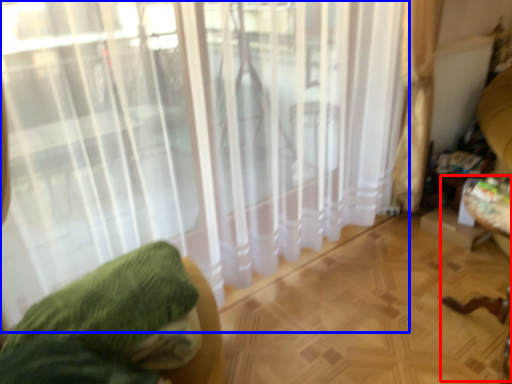
Question: Which object appears farthest to the camera in this image, swivel chair (highlighted by a red box) or curtain (highlighted by a blue box)?

Choices:
 (A) swivel chair
 (B) curtain

Answer: (A)